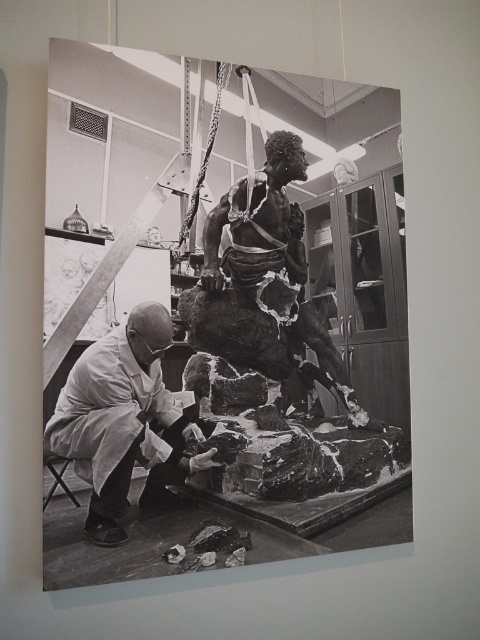
Is white lab coat at lower left smaller than rough stone statue at center?

Yes.

Can you confirm if white lab coat at lower left is positioned above rough stone statue at center?

No, white lab coat at lower left is not above rough stone statue at center.

Is point (127, 428) positioned behind point (265, 280)?

No, (127, 428) is closer to viewer.

You are a GUI agent. You are given a task and a screenshot of the screen. Output one action in this format:
    pyautogui.click(x=<x>, y=<y>)
    Task: Click on the white lab coat at lower left
    The image size is (480, 640).
    Given the screenshot: What is the action you would take?
    pyautogui.click(x=124, y=420)